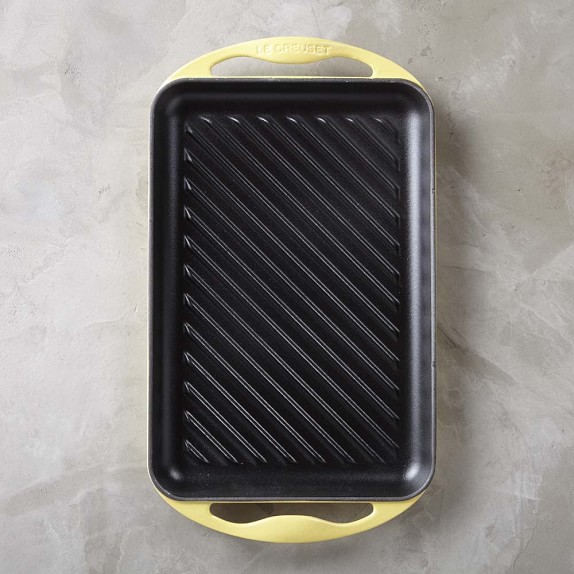
In order to click on food plate in this screenshot , I will do tap(310, 375).